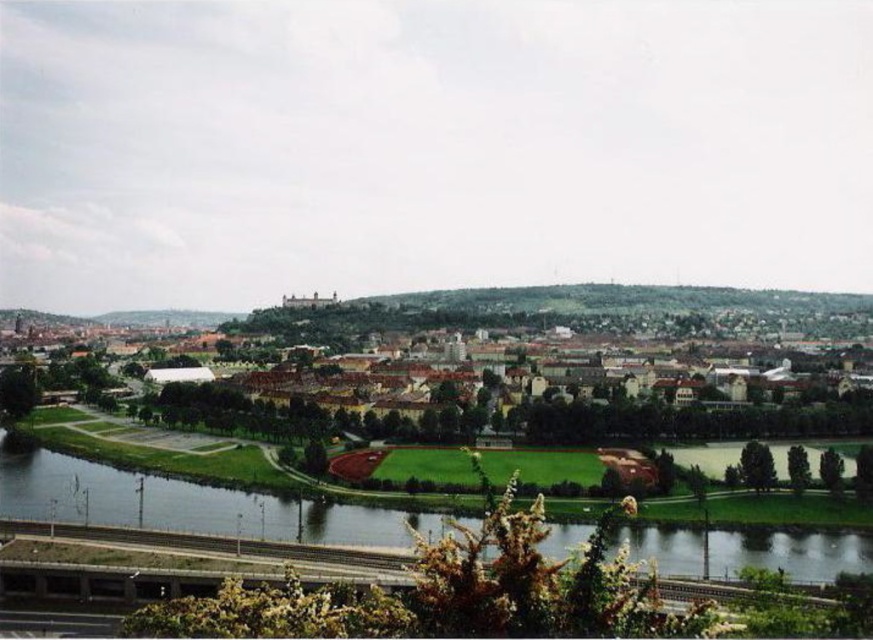
Consider the image. You are a drone operator planning to fly a drone from the green grassy field at center to the green grass at lower center. Given that the drone has a maximum flight range of 150 meters, will it be able to reach its destination without needing a recharge?

The green grassy field at center is 158.63 meters away from the green grass at lower center. Since the drone can only fly up to 150 meters before needing a recharge, it will not be able to reach the destination without recharging.

You are a drone operator trying to capture a photo of the green grassy field at center and the green grass at lower center. According to the scene description, which of these two areas is positioned farther away from the camera?

The green grass at lower center is behind the green grassy field at center, so it is farther away from the camera.